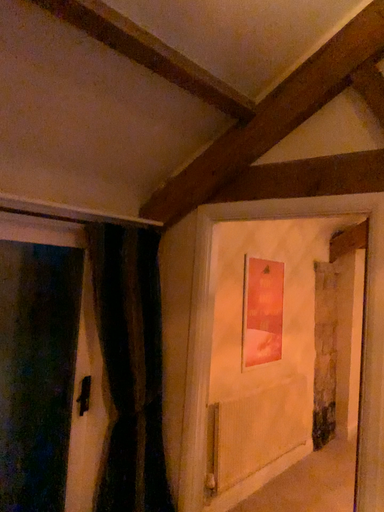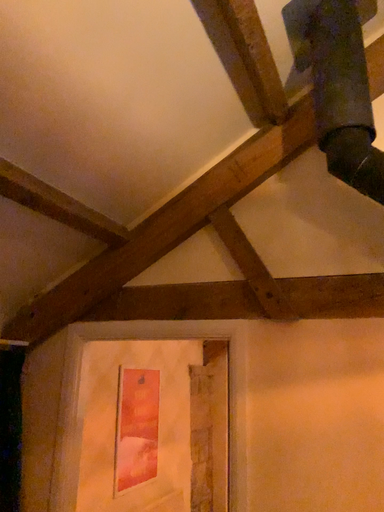
Question: How did the camera likely rotate when shooting the video?

Choices:
 (A) rotated left
 (B) rotated right

Answer: (B)